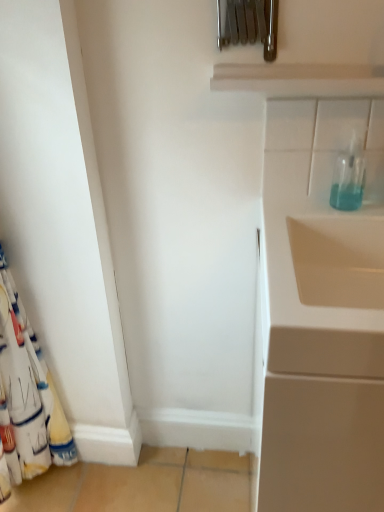
You are a GUI agent. You are given a task and a screenshot of the screen. Output one action in this format:
    pyautogui.click(x=<x>, y=<y>)
    Task: Click on the free space to the left of transparent glass bottle at upper right
    
    Given the screenshot: What is the action you would take?
    pyautogui.click(x=301, y=208)